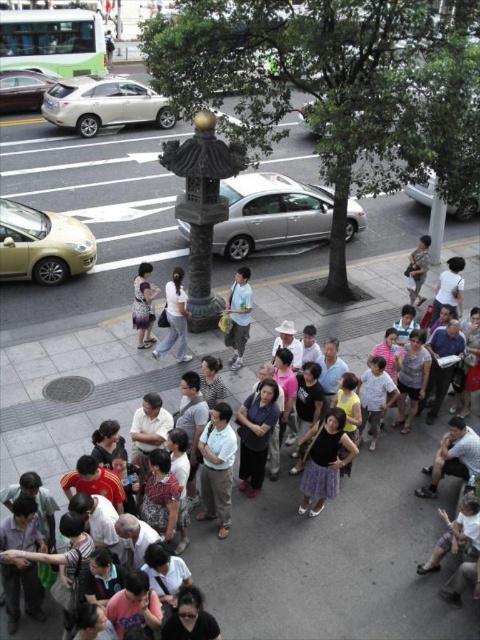
You are a photographer standing at the elevated viewpoint capturing this urban scene. You notice two people wearing the light blue jeans at center and the matte black dress at center. Which clothing item is positioned lower in the image?

The light blue jeans at center is below the matte black dress at center, so the light blue jeans at center is positioned lower in the image.

In the urban scene with a group of people near a stone lantern, where exactly is the light blue fabric shirt at center located in terms of coordinates?

The light blue fabric shirt at center is located at coordinates point (217, 467).